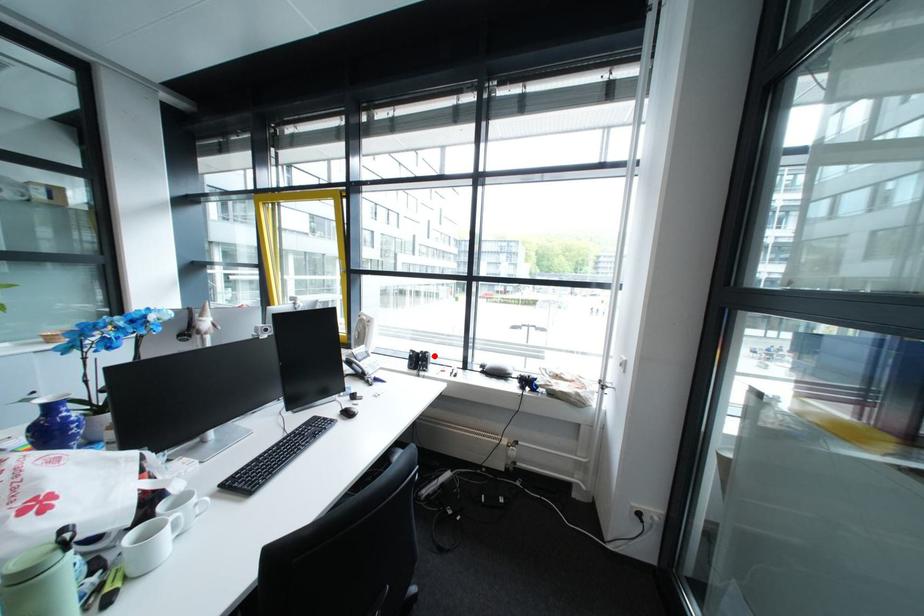
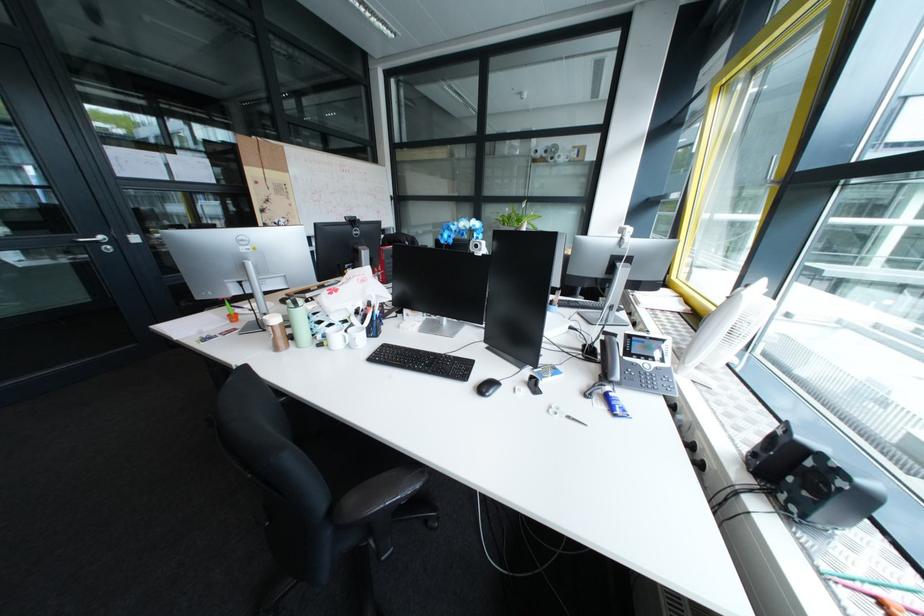
Question: I am providing you with two images of the same scene from different viewpoints. Image1 has a red point marked. In image2, the corresponding 3D location appears at what relative position? Reply with the corresponding letter.

Choices:
 (A) Closer
 (B) Farther

Answer: (B)